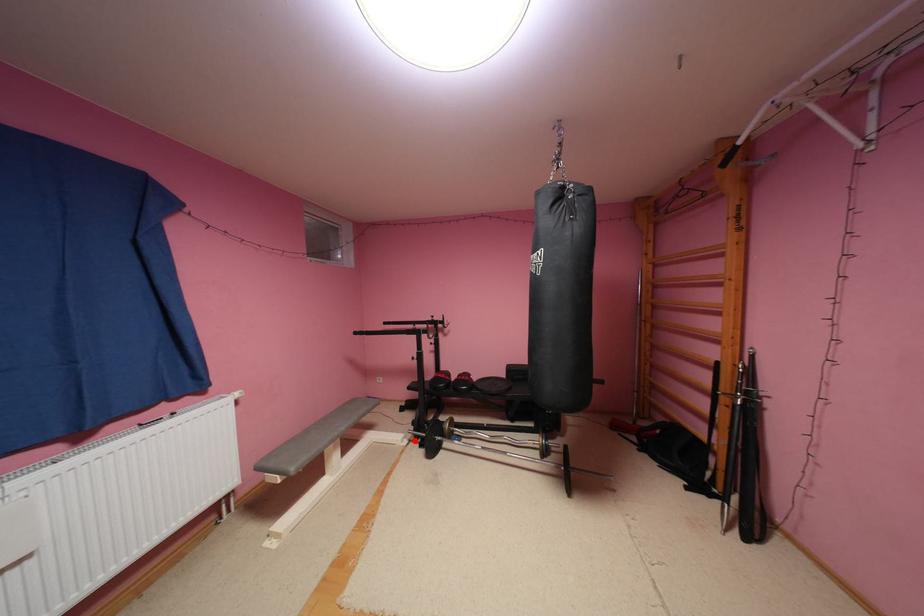
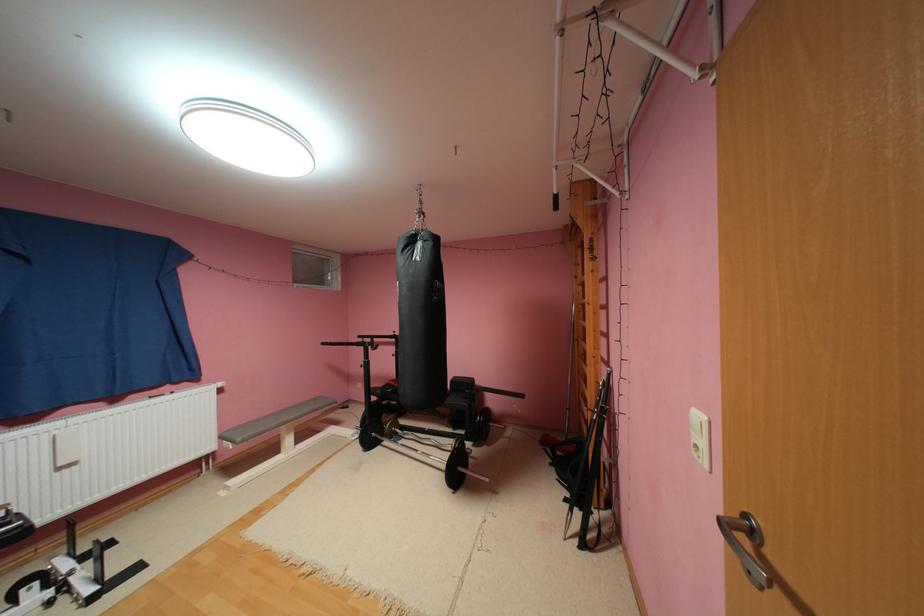
Where in the second image is the point corresponding to the highlighted location from the first image?

(366, 436)